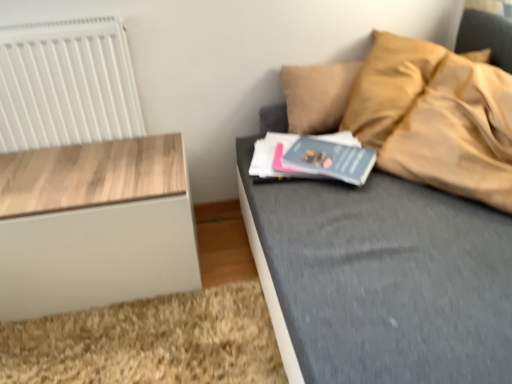
Question: Considering the positions of white plastic radiator at upper left and gray matte book at center in the image, is white plastic radiator at upper left bigger or smaller than gray matte book at center?

Choices:
 (A) big
 (B) small

Answer: (A)

Question: From their relative heights in the image, would you say white plastic radiator at upper left is taller or shorter than gray matte book at center?

Choices:
 (A) short
 (B) tall

Answer: (B)

Question: Which is nearer to the gray matte book at center?

Choices:
 (A) wooden nightstand at left
 (B) white plastic radiator at upper left

Answer: (A)

Question: Estimate the real-world distances between objects in this image. Which object is farther from the wooden nightstand at left?

Choices:
 (A) white plastic radiator at upper left
 (B) gray matte book at center

Answer: (B)